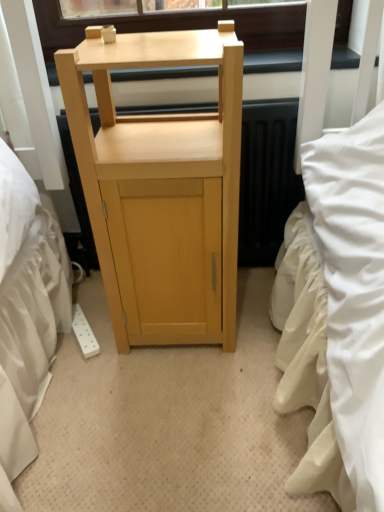
This screenshot has width=384, height=512. Identify the location of vacant space to the left of light wood cabinet at center. (85, 350).